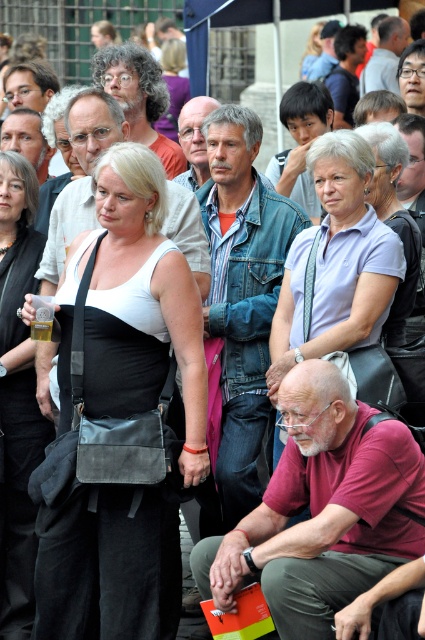
Is light purple fabric shirt at upper center wider than black leather bag at center?

Yes.

Between point (359, 307) and point (33, 557), which one is positioned in front?

Point (359, 307) is more forward.

The image size is (425, 640). Find the location of `light purple fabric shirt at upper center`. light purple fabric shirt at upper center is located at coordinates pyautogui.click(x=337, y=262).

Does matte black bag at center have a lesser width compared to light purple fabric shirt at upper center?

Incorrect, matte black bag at center's width is not less than light purple fabric shirt at upper center's.

This screenshot has width=425, height=640. Identify the location of matte black bag at center. (121, 419).

This screenshot has width=425, height=640. What do you see at coordinates (121, 419) in the screenshot?
I see `matte black bag at center` at bounding box center [121, 419].

What are the coordinates of `matte black bag at center` in the screenshot? It's located at pyautogui.click(x=121, y=419).

Can you confirm if matte black bag at center is bigger than black leather bag at center?

Indeed, matte black bag at center has a larger size compared to black leather bag at center.

Which is in front, point (96, 273) or point (19, 198)?

Point (96, 273) is more forward.

Locate an element on the screen. matte black bag at center is located at coordinates (121, 419).